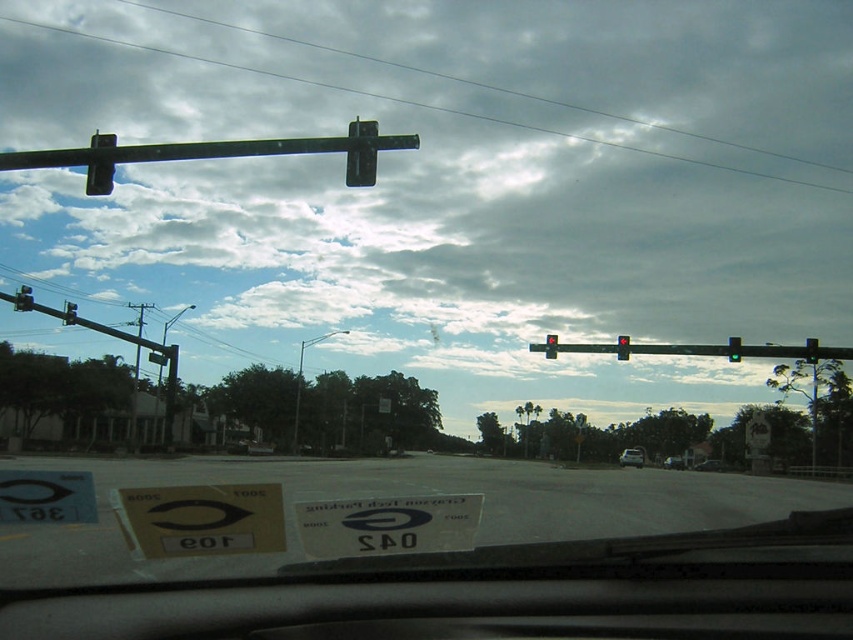
Question: Which is farther from the metallic pole at center?

Choices:
 (A) white paper at center
 (B) red glass traffic light at upper center

Answer: (B)

Question: Considering the real-world distances, which object is farthest from the red glass traffic light at upper center?

Choices:
 (A) silver metallic sedan at center
 (B) red glass traffic light at upper right
 (C) metallic pole at center

Answer: (C)

Question: Which point is farther to the camera?

Choices:
 (A) metallic traffic light at upper left
 (B) black plastic traffic light at upper left
 (C) white matte car at center

Answer: (C)

Question: Does white paper at center appear over black plastic traffic light at upper left?

Choices:
 (A) no
 (B) yes

Answer: (A)

Question: Can you confirm if black plastic traffic light at upper center is wider than metallic traffic light at upper left?

Choices:
 (A) no
 (B) yes

Answer: (B)

Question: Can you confirm if white paper at center is smaller than red glass traffic light at upper center?

Choices:
 (A) no
 (B) yes

Answer: (A)